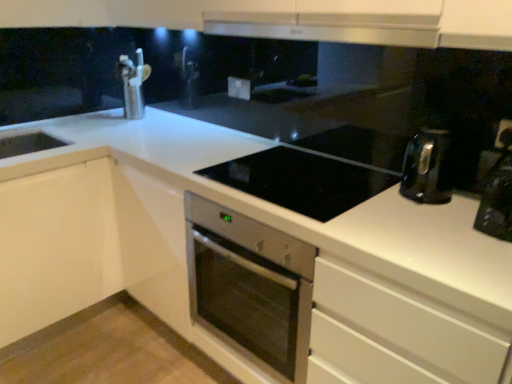
Question: From a real-world perspective, is black glossy coffee machine at right positioned over satin silver exhaust hood at upper center based on gravity?

Choices:
 (A) no
 (B) yes

Answer: (A)

Question: Can you confirm if black glossy coffee machine at right is bigger than satin silver exhaust hood at upper center?

Choices:
 (A) yes
 (B) no

Answer: (B)

Question: Does black glossy coffee machine at right have a greater width compared to satin silver exhaust hood at upper center?

Choices:
 (A) no
 (B) yes

Answer: (A)

Question: From a real-world perspective, is black glossy coffee machine at right under satin silver exhaust hood at upper center?

Choices:
 (A) yes
 (B) no

Answer: (A)

Question: Is black glossy coffee machine at right thinner than satin silver exhaust hood at upper center?

Choices:
 (A) yes
 (B) no

Answer: (A)

Question: Is black glossy coffee machine at right shorter than satin silver exhaust hood at upper center?

Choices:
 (A) no
 (B) yes

Answer: (A)

Question: Considering the relative sizes of white plastic electric outlet at upper center, the 2th electric outlet positioned from the left, and white plastic electric outlet at center, which is counted as the 2th electric outlet, starting from the bottom, in the image provided, is white plastic electric outlet at upper center, the 2th electric outlet positioned from the left, taller than white plastic electric outlet at center, which is counted as the 2th electric outlet, starting from the bottom,?

Choices:
 (A) no
 (B) yes

Answer: (A)

Question: Does white plastic electric outlet at upper center, the 2th electric outlet positioned from the left, have a smaller size compared to white plastic electric outlet at center, which is counted as the 2th electric outlet, starting from the right?

Choices:
 (A) no
 (B) yes

Answer: (A)

Question: Can you confirm if white plastic electric outlet at upper center, the 2th electric outlet when ordered from back to front, is positioned to the left of white plastic electric outlet at center, the first electric outlet positioned from the top?

Choices:
 (A) yes
 (B) no

Answer: (B)

Question: Does white plastic electric outlet at upper center, the 2th electric outlet when ordered from back to front, lie behind white plastic electric outlet at center, which is counted as the 2th electric outlet, starting from the right?

Choices:
 (A) yes
 (B) no

Answer: (B)

Question: From a real-world perspective, is white plastic electric outlet at upper center, which appears as the 1th electric outlet when viewed from the front, physically below white plastic electric outlet at center, the 1th electric outlet viewed from the left?

Choices:
 (A) yes
 (B) no

Answer: (B)

Question: Does white plastic electric outlet at upper center, positioned as the first electric outlet in right-to-left order, have a lesser height compared to white plastic electric outlet at center, which is counted as the 2th electric outlet, starting from the right?

Choices:
 (A) yes
 (B) no

Answer: (A)

Question: Is stainless steel oven at center positioned far away from brushed metal faucet at upper left?

Choices:
 (A) yes
 (B) no

Answer: (A)